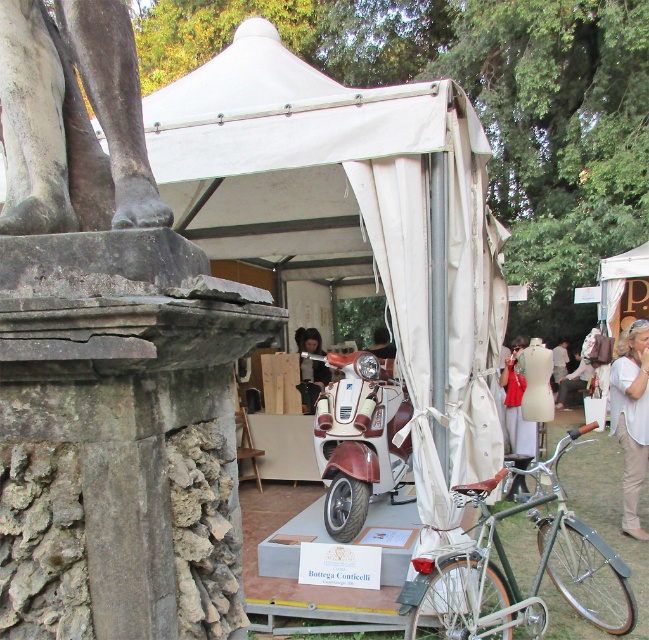
Based on the photo, can you confirm if gray stone statue at upper left is positioned above white cotton dress at center?

Yes, gray stone statue at upper left is above white cotton dress at center.

Is gray stone statue at upper left to the right of white cotton dress at center from the viewer's perspective?

No, gray stone statue at upper left is not to the right of white cotton dress at center.

You are a GUI agent. You are given a task and a screenshot of the screen. Output one action in this format:
    pyautogui.click(x=<x>, y=<y>)
    Task: Click on the gray stone statue at upper left
    The image size is (649, 640).
    Given the screenshot: What is the action you would take?
    pyautogui.click(x=71, y=120)

Consider the image. Measure the distance between point [308,376] and camera.

Point [308,376] and camera are 28.80 feet apart from each other.

Is dark brown leather jacket at center below white cotton dress at center?

Yes, dark brown leather jacket at center is below white cotton dress at center.

Is point (304, 358) positioned behind point (556, 349)?

No.

Where is `dark brown leather jacket at center`? The width and height of the screenshot is (649, 640). dark brown leather jacket at center is located at coordinates (312, 380).

Who is taller, gray stone statue at upper left or matte white scooter at center?

matte white scooter at center is taller.

Is gray stone statue at upper left further to camera compared to matte white scooter at center?

No, gray stone statue at upper left is in front of matte white scooter at center.

Does point (32, 218) come behind point (397, 467)?

No, (32, 218) is in front of (397, 467).

Find the location of a particular element. This screenshot has height=640, width=649. gray stone statue at upper left is located at coordinates (71, 120).